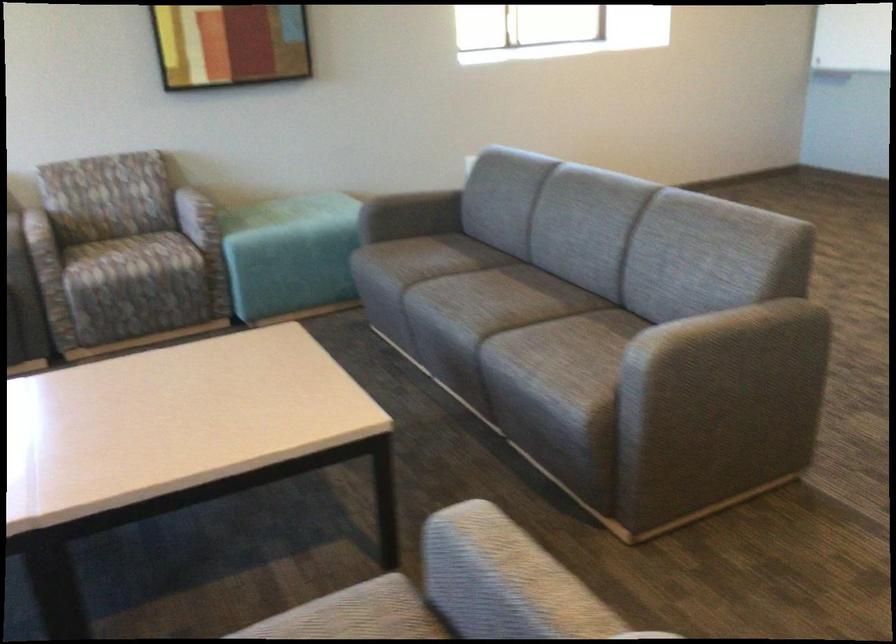
Find where to sit the chair sitting surface. Please return your answer as a coordinate pair (x, y).

(125, 259)